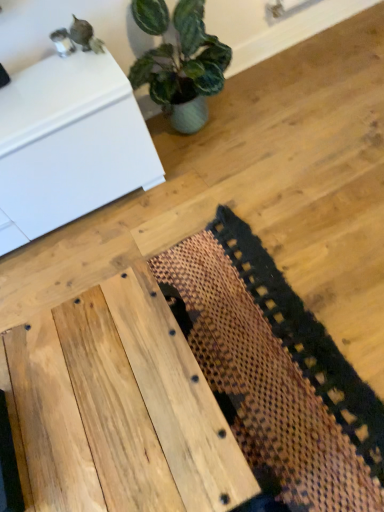
What is the approximate height of natural wood table at center?

The height of natural wood table at center is 13.29 inches.

I want to click on white glossy cabinet at upper left, so click(x=69, y=145).

From a real-world perspective, between white glossy cabinet at upper left and brown woven mat at center, who is vertically lower?

brown woven mat at center.

Is white glossy cabinet at upper left far away from brown woven mat at center?

That's not correct — white glossy cabinet at upper left is a little close to brown woven mat at center.

Is point (54, 87) more distant than point (338, 486)?

Yes, it is behind point (338, 486).

Which is in front, white glossy cabinet at upper left or brown woven mat at center?

brown woven mat at center is closer to the camera.

Considering the relative positions of white glossy cabinet at upper left and natural wood table at center in the image provided, is white glossy cabinet at upper left behind natural wood table at center?

Yes, white glossy cabinet at upper left is behind natural wood table at center.

Does white glossy cabinet at upper left have a larger size compared to natural wood table at center?

Yes, white glossy cabinet at upper left is bigger than natural wood table at center.

Is white glossy cabinet at upper left wider or thinner than natural wood table at center?

white glossy cabinet at upper left is thinner than natural wood table at center.

From the image's perspective, which object appears higher, white glossy cabinet at upper left or natural wood table at center?

white glossy cabinet at upper left.

Can you confirm if brown woven mat at center is positioned to the left of white glossy cabinet at upper left?

Incorrect, brown woven mat at center is not on the left side of white glossy cabinet at upper left.

Is brown woven mat at center smaller than white glossy cabinet at upper left?

Yes, brown woven mat at center is smaller than white glossy cabinet at upper left.

Is brown woven mat at center not near white glossy cabinet at upper left?

brown woven mat at center is near white glossy cabinet at upper left, not far away.

From the image's perspective, is brown woven mat at center positioned above or below white glossy cabinet at upper left?

Clearly, from the image's perspective, brown woven mat at center is below white glossy cabinet at upper left.

Considering the positions of points (111, 300) and (219, 227), is point (111, 300) farther from camera compared to point (219, 227)?

No, it is in front of (219, 227).

Which is more to the right, natural wood table at center or brown woven mat at center?

Positioned to the right is brown woven mat at center.

In the scene shown: Can you confirm if natural wood table at center is thinner than brown woven mat at center?

Yes, natural wood table at center is thinner than brown woven mat at center.

Consider the image. Is brown woven mat at center aimed at natural wood table at center?

Yes, brown woven mat at center is turned towards natural wood table at center.

Is brown woven mat at center taller or shorter than natural wood table at center?

Clearly, brown woven mat at center is shorter compared to natural wood table at center.

Is brown woven mat at center placed right next to natural wood table at center?

No, brown woven mat at center is not in contact with natural wood table at center.

Is natural wood table at center oriented away from white glossy cabinet at upper left?

Yes, white glossy cabinet at upper left is at the back of natural wood table at center.

From a real-world perspective, is natural wood table at center beneath white glossy cabinet at upper left?

Yes, from a real-world perspective, natural wood table at center is under white glossy cabinet at upper left.

Can you tell me how much natural wood table at center and white glossy cabinet at upper left differ in facing direction?

There is a 0.537-degree angle between the facing directions of natural wood table at center and white glossy cabinet at upper left.

Considering the sizes of objects natural wood table at center and white glossy cabinet at upper left in the image provided, who is thinner, natural wood table at center or white glossy cabinet at upper left?

With smaller width is white glossy cabinet at upper left.

I want to click on mat below the white glossy cabinet at upper left (from the image's perspective), so click(274, 374).

The width and height of the screenshot is (384, 512). I want to click on furniture that is on the left side of natural wood table at center, so click(x=69, y=145).

From the image, which object appears to be farther from natural wood table at center, brown woven mat at center or white glossy cabinet at upper left?

white glossy cabinet at upper left.

Based on their spatial positions, is natural wood table at center or brown woven mat at center further from white glossy cabinet at upper left?

natural wood table at center is positioned further to the anchor white glossy cabinet at upper left.

Which object lies further to the anchor point brown woven mat at center, white glossy cabinet at upper left or natural wood table at center?

white glossy cabinet at upper left is further to brown woven mat at center.

Consider the image. Looking at the image, which one is located closer to white glossy cabinet at upper left, brown woven mat at center or natural wood table at center?

brown woven mat at center is positioned closer to the anchor white glossy cabinet at upper left.

From the image, which object appears to be nearer to natural wood table at center, white glossy cabinet at upper left or brown woven mat at center?

brown woven mat at center is positioned closer to the anchor natural wood table at center.

Which object lies further to the anchor point brown woven mat at center, natural wood table at center or white glossy cabinet at upper left?

white glossy cabinet at upper left.

Find the location of a particular element. mat that lies between white glossy cabinet at upper left and natural wood table at center from top to bottom is located at coordinates (274, 374).